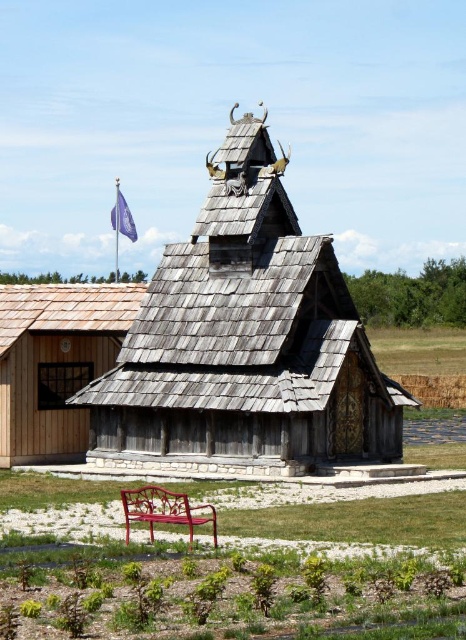
Question: From the image, what is the correct spatial relationship of weathered wood chapel at center in relation to metallic red bench at center?

Choices:
 (A) left
 (B) right

Answer: (A)

Question: Is weathered wood chapel at center to the right of metallic red bench at center from the viewer's perspective?

Choices:
 (A) no
 (B) yes

Answer: (A)

Question: Which object is farther from the camera taking this photo?

Choices:
 (A) weathered wood chapel at center
 (B) metallic red bench at center

Answer: (A)

Question: Where is weathered wood chapel at center located in relation to metallic red bench at center in the image?

Choices:
 (A) above
 (B) below

Answer: (A)